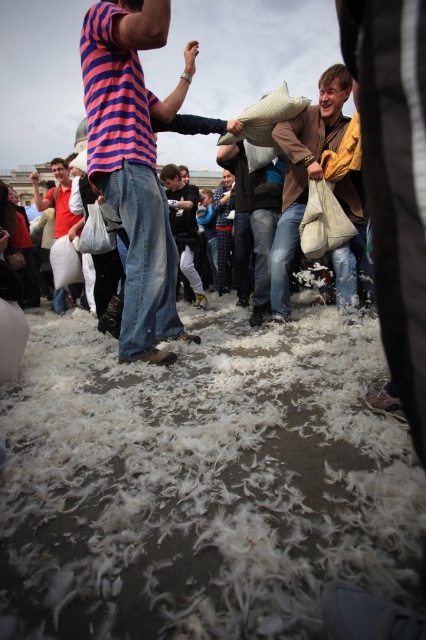
Question: Which point is farther from the camera taking this photo?

Choices:
 (A) (100, 118)
 (B) (328, 134)
 (C) (229, 227)

Answer: (C)

Question: Does striped cotton shirt at center have a larger size compared to blue plaid shirt at center?

Choices:
 (A) yes
 (B) no

Answer: (A)

Question: Estimate the real-world distances between objects in this image. Which object is farther from the striped cotton shirt at center?

Choices:
 (A) blue plaid shirt at center
 (B) matte red shirt at left
 (C) white fabric pillow at center
 (D) dark blue jeans at center

Answer: (A)

Question: Does dark blue jeans at center have a larger size compared to matte red shirt at left?

Choices:
 (A) no
 (B) yes

Answer: (A)

Question: Estimate the real-world distances between objects in this image. Which object is farther from the matte red shirt at left?

Choices:
 (A) striped cotton shirt at center
 (B) brown leather jacket at upper center
 (C) blue plaid shirt at center

Answer: (B)

Question: Where is matte red shirt at left located in relation to blue plaid shirt at center in the image?

Choices:
 (A) right
 (B) left

Answer: (B)